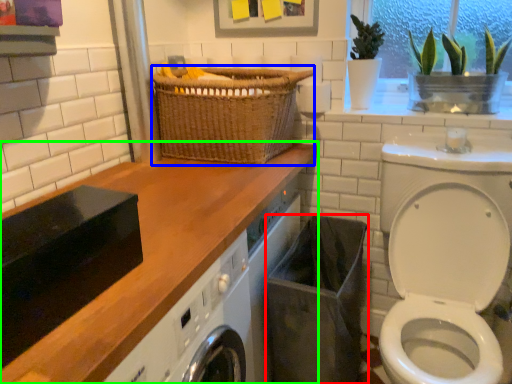
Question: Considering the real-world distances, which object is farthest from laundry basket (highlighted by a red box)? basket (highlighted by a blue box) or countertop (highlighted by a green box)?

Choices:
 (A) basket
 (B) countertop

Answer: (A)